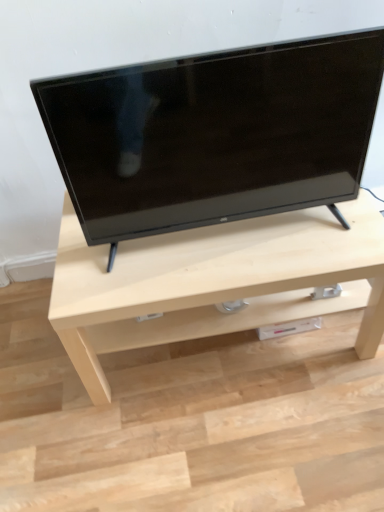
Where is `vacant area that lies in front of light wood table at center`? vacant area that lies in front of light wood table at center is located at coordinates (245, 438).